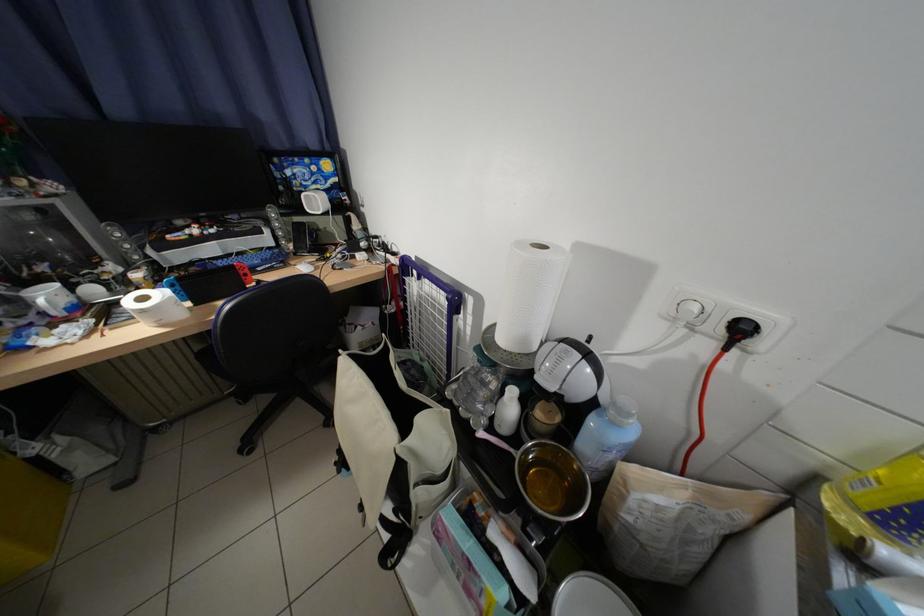
Find the location of `white power plug`. white power plug is located at coordinates (723, 317).